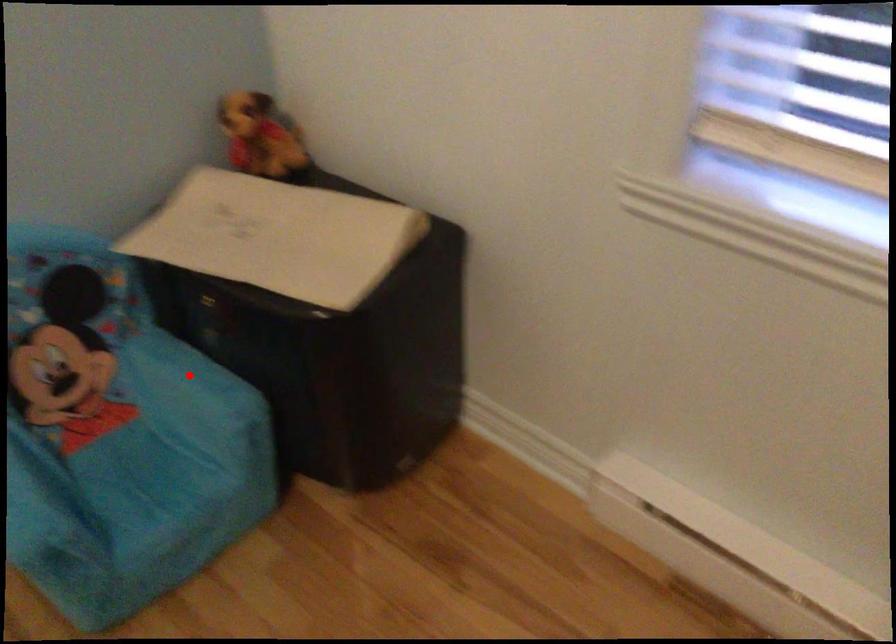
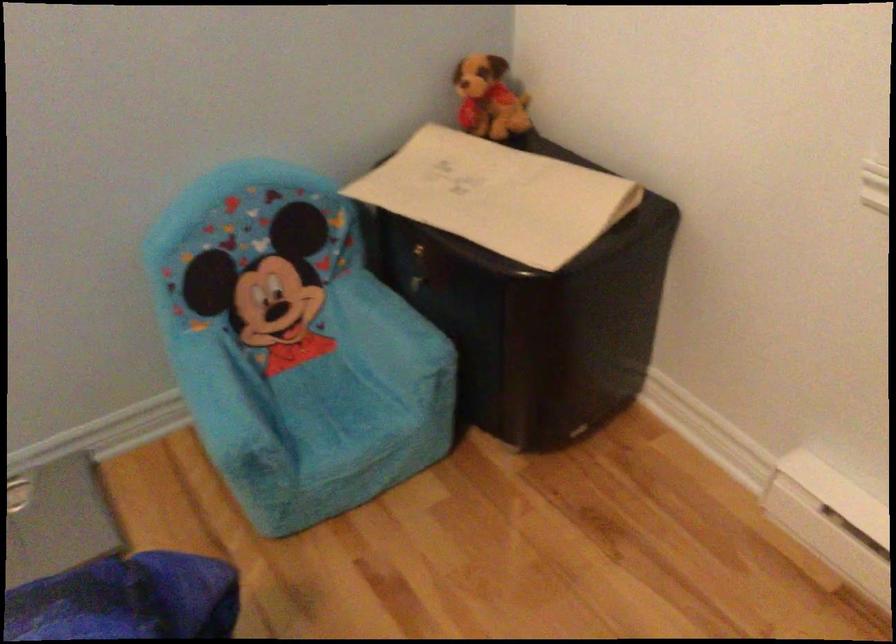
Question: I am providing you with two images of the same scene from different viewpoints. A red point is marked on the first image. At the location where the point appears in image 1, is it still visible in image 2?

Choices:
 (A) Yes
 (B) No

Answer: (A)